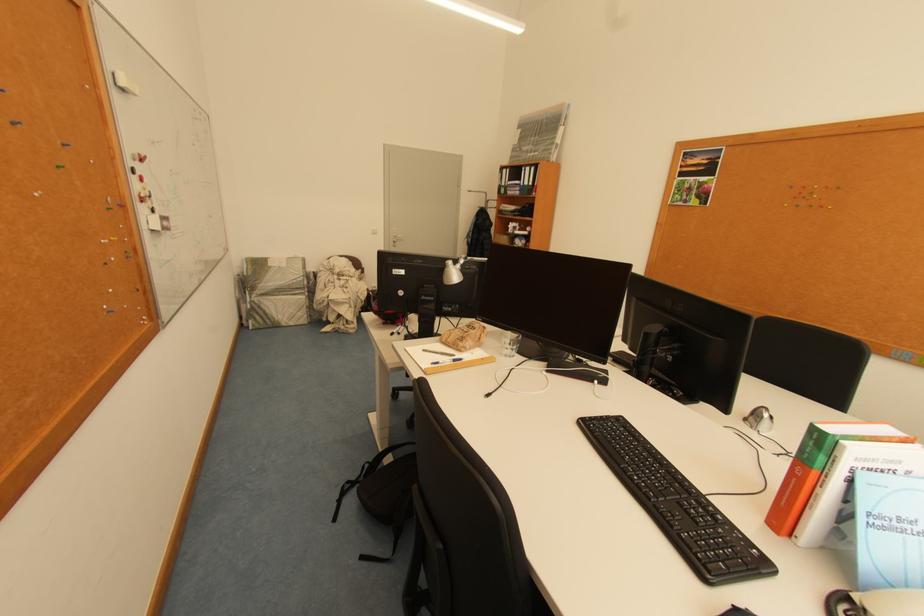
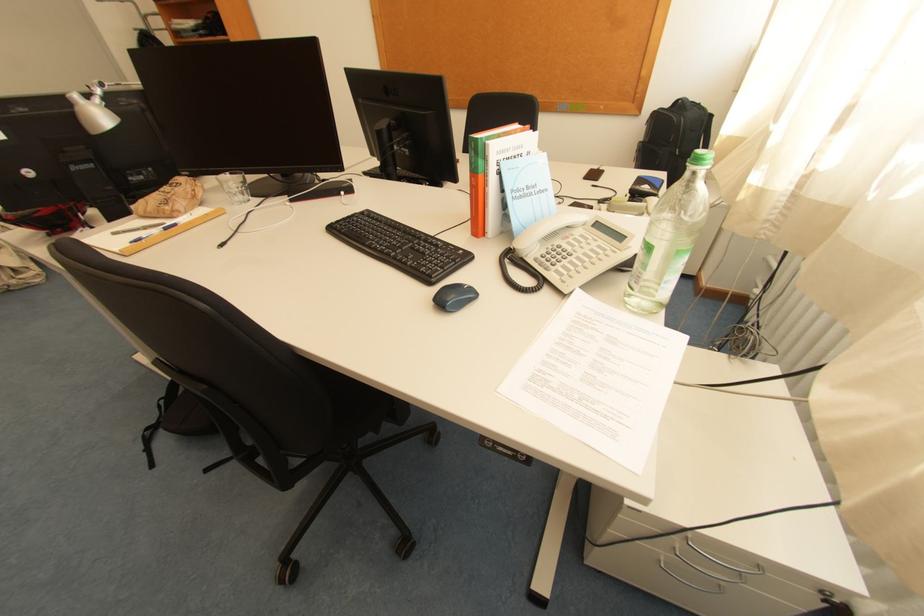
Find the pixel in the second image that matches (454,345) in the first image.

(155, 217)